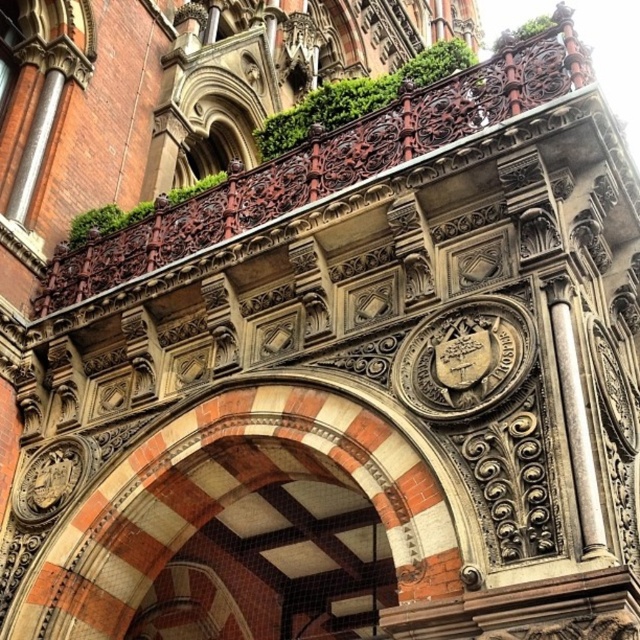
Question: Which of the following is the closest to the observer?

Choices:
 (A) white marble column at center
 (B) red brick arch at center
 (C) green leafy ivy at upper center

Answer: (A)

Question: Is red brick arch at center below white marble column at center?

Choices:
 (A) yes
 (B) no

Answer: (A)

Question: Which object is the farthest from the red brick arch at center?

Choices:
 (A) white marble column at center
 (B) green leafy ivy at upper center

Answer: (B)

Question: Which object appears closest to the camera in this image?

Choices:
 (A) white marble column at center
 (B) green leafy ivy at upper center
 (C) red brick arch at center

Answer: (A)

Question: Is red brick arch at center smaller than white marble column at center?

Choices:
 (A) yes
 (B) no

Answer: (B)

Question: Does green leafy ivy at upper center lie behind white marble column at center?

Choices:
 (A) no
 (B) yes

Answer: (B)